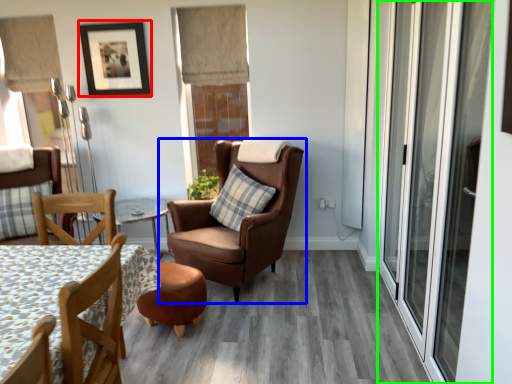
Question: Which is farther away from picture frame (highlighted by a red box)? chair (highlighted by a blue box) or screen door (highlighted by a green box)?

Choices:
 (A) chair
 (B) screen door

Answer: (B)